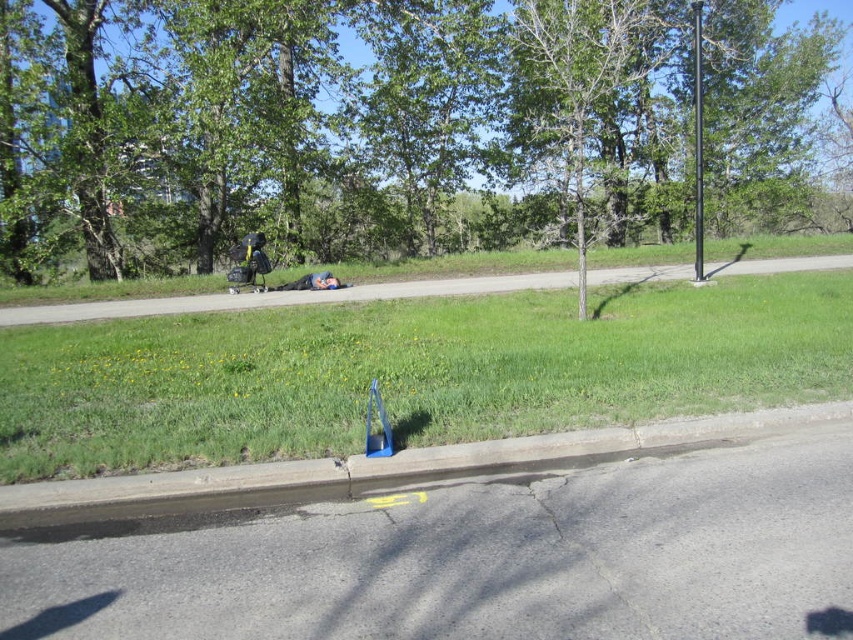
Question: Estimate the real-world distances between objects in this image. Which object is farther from the green grass at lower center?

Choices:
 (A) blue plastic curb at lower left
 (B) black metal pole at center right

Answer: (B)

Question: Which point is closer to the camera?

Choices:
 (A) (697, 152)
 (B) (67, 524)
 (C) (68, 4)

Answer: (B)

Question: Based on their relative distances, which object is nearer to the blue plastic curb at lower left?

Choices:
 (A) green leafy tree at upper center
 (B) black metal pole at center right
 (C) green grass at lower center

Answer: (C)

Question: Considering the relative positions of green grass at lower center and black metal pole at center right in the image provided, where is green grass at lower center located with respect to black metal pole at center right?

Choices:
 (A) left
 (B) right

Answer: (A)

Question: Does green leafy tree at upper center have a lesser width compared to green grass at lower center?

Choices:
 (A) yes
 (B) no

Answer: (B)

Question: In this image, where is green leafy tree at upper center located relative to green grass at lower center?

Choices:
 (A) below
 (B) above

Answer: (B)